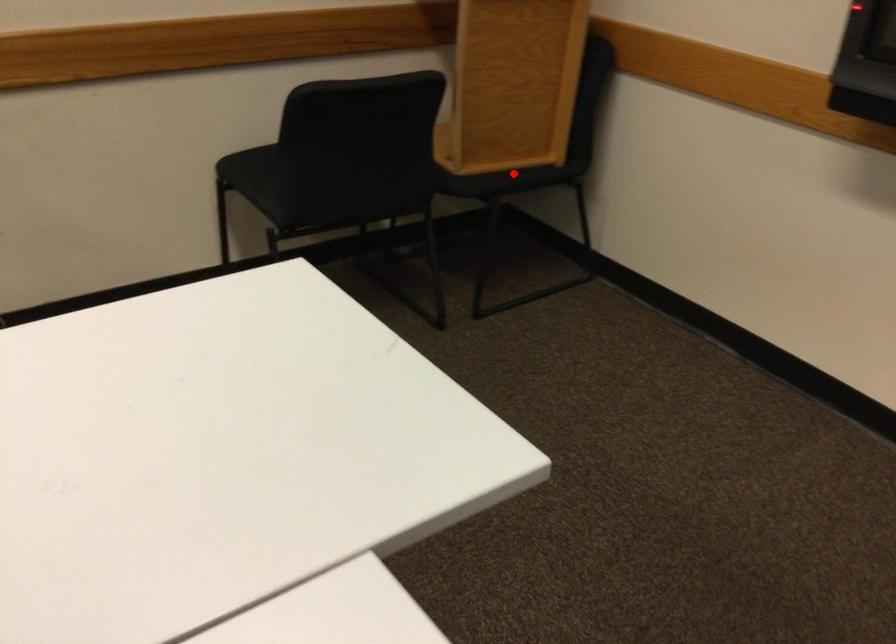
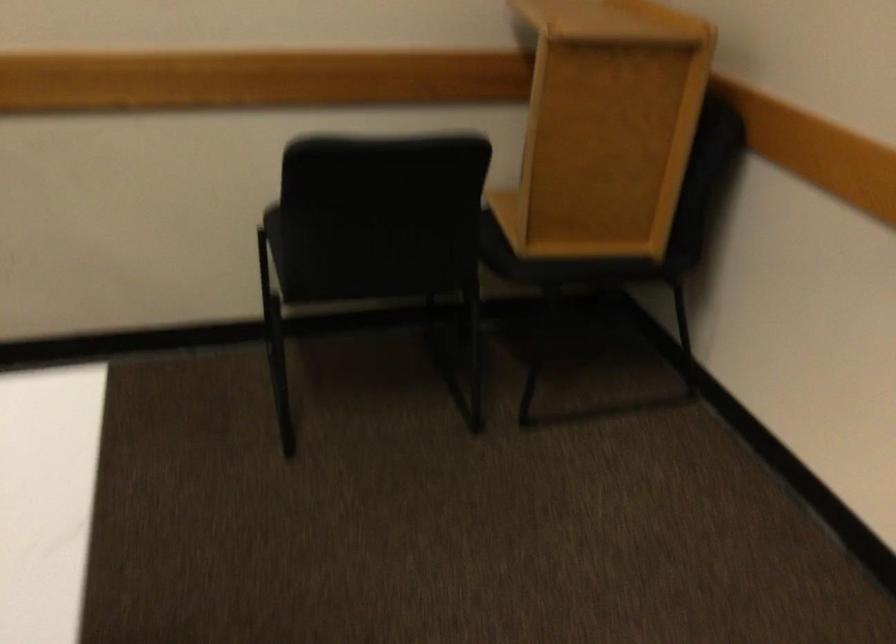
Question: I am providing you with two images of the same scene from different viewpoints. Image1 has a red point marked. In image2, the corresponding 3D location appears at what relative position? Reply with the corresponding letter.

Choices:
 (A) Closer
 (B) Farther

Answer: (A)